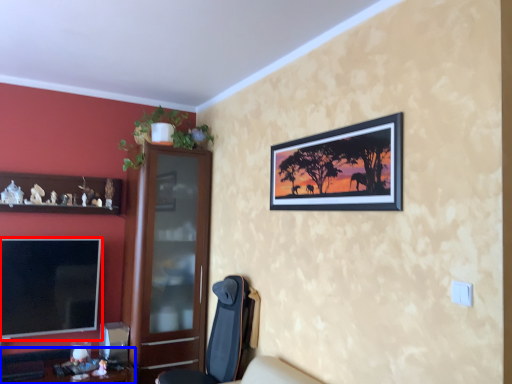
Question: Among these objects, which one is nearest to the camera, television (highlighted by a red box) or desk (highlighted by a blue box)?

Choices:
 (A) television
 (B) desk

Answer: (B)